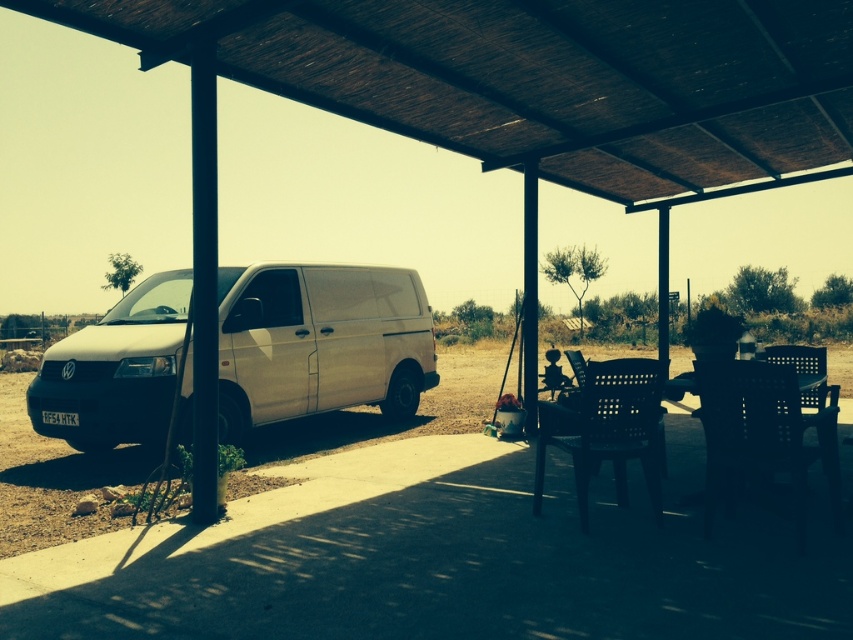
You are planning to move the white matte van at left into a parking spot that is exactly the same width as the black plastic chair at center. Will the van fit in the parking spot?

The white matte van at left is wider than the black plastic chair at center, so it will not fit in a parking spot that is the same width as the chair.

You are planning to set up a small event and need to know which of the two black plastic chairs is wider to accommodate more guests. Which one between the black plastic chair at lower right and the black plastic chair at center is wider?

The black plastic chair at center is wider than the black plastic chair at lower right, so it can accommodate more guests.